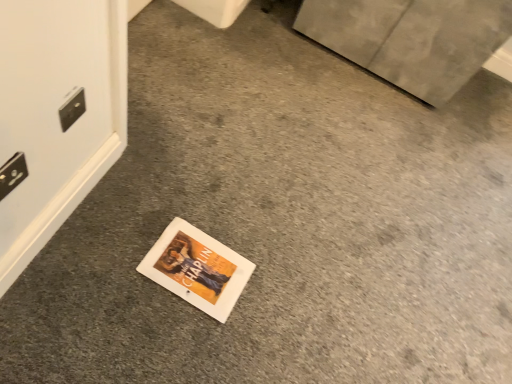
Question: In the image, is white plastic electric outlet at upper left, the 1th electric outlet from the top, on the left side or the right side of black plastic electric outlet at lower left, which is the second electric outlet from right to left?

Choices:
 (A) right
 (B) left

Answer: (A)

Question: From the image's perspective, is white plastic electric outlet at upper left, marked as the 1th electric outlet in a back-to-front arrangement, above or below black plastic electric outlet at lower left, which is the 1th electric outlet in left-to-right order?

Choices:
 (A) above
 (B) below

Answer: (A)

Question: From a real-world perspective, is white plastic electric outlet at upper left, marked as the 1th electric outlet in a back-to-front arrangement, positioned above or below black plastic electric outlet at lower left, positioned as the 2th electric outlet in top-to-bottom order?

Choices:
 (A) above
 (B) below

Answer: (A)

Question: Is black plastic electric outlet at lower left, arranged as the first electric outlet when ordered from the bottom, wider or thinner than white plastic electric outlet at upper left, marked as the 1th electric outlet in a back-to-front arrangement?

Choices:
 (A) wide
 (B) thin

Answer: (A)

Question: In the image, is black plastic electric outlet at lower left, the 1th electric outlet in the front-to-back sequence, positioned in front of or behind white plastic electric outlet at upper left, which ranks as the second electric outlet in bottom-to-top order?

Choices:
 (A) behind
 (B) front

Answer: (B)

Question: Choose the correct answer: Is black plastic electric outlet at lower left, arranged as the first electric outlet when ordered from the bottom, inside white plastic electric outlet at upper left, acting as the 2th electric outlet starting from the left, or outside it?

Choices:
 (A) outside
 (B) inside

Answer: (A)

Question: Is black plastic electric outlet at lower left, which is the 1th electric outlet in left-to-right order, to the left or to the right of white plastic electric outlet at upper left, acting as the 2th electric outlet starting from the left, in the image?

Choices:
 (A) right
 (B) left

Answer: (B)